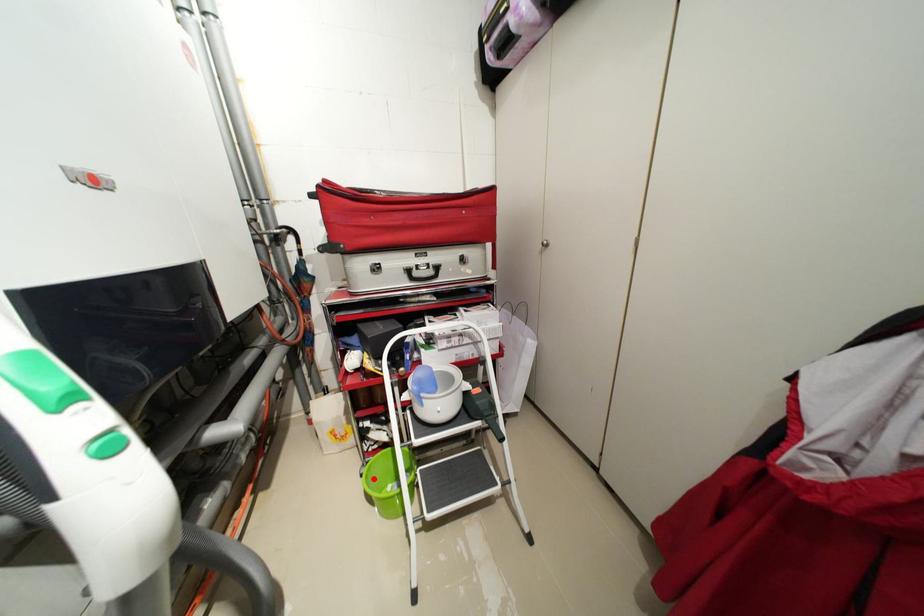
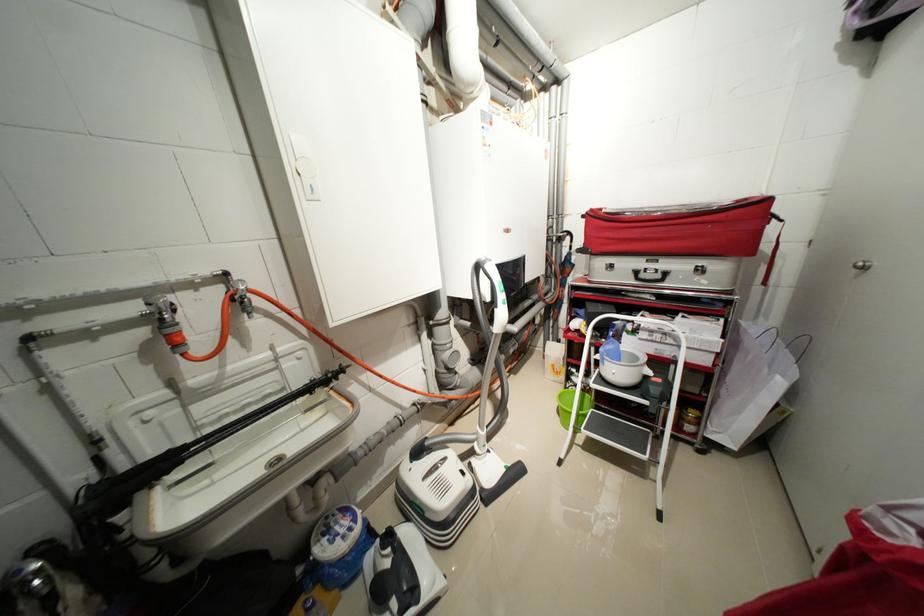
Question: I am providing you with two images of the same scene from different viewpoints. Given a red point in image1, look at the same physical point in image2. Is it:

Choices:
 (A) Closer to the viewpoint
 (B) Farther from the viewpoint

Answer: (A)